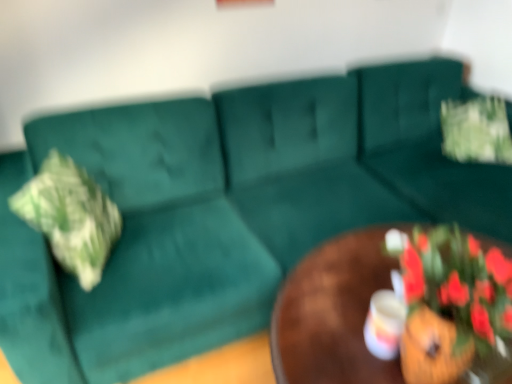
The height and width of the screenshot is (384, 512). I want to click on green fabric flower at upper right, so click(476, 130).

Would you say green textured pillow at left is part of matte white coffee cup at center's contents?

That's incorrect, green textured pillow at left is not inside matte white coffee cup at center.

Can you confirm if matte white coffee cup at center is thinner than green textured pillow at left?

Correct, the width of matte white coffee cup at center is less than that of green textured pillow at left.

Is the position of matte white coffee cup at center more distant than that of green textured pillow at left?

No, it is in front of green textured pillow at left.

Does matte white coffee cup at center have a smaller size compared to green textured pillow at left?

Indeed, matte white coffee cup at center has a smaller size compared to green textured pillow at left.

Can you confirm if matte white coffee cup at center is thinner than brown wooden table at center?

Yes, matte white coffee cup at center is thinner than brown wooden table at center.

Is matte white coffee cup at center oriented away from brown wooden table at center?

No.

Locate an element on the screen. This screenshot has width=512, height=384. coffee cup behind the brown wooden table at center is located at coordinates (384, 324).

Consider the image. Do you think matte white coffee cup at center is within brown wooden table at center, or outside of it?

matte white coffee cup at center is inside brown wooden table at center.

Considering the relative sizes of green textured pillow at left and green fabric flower at upper right in the image provided, is green textured pillow at left shorter than green fabric flower at upper right?

In fact, green textured pillow at left may be taller than green fabric flower at upper right.

The image size is (512, 384). In order to click on pillow below the green fabric flower at upper right (from the image's perspective) in this screenshot , I will do `click(70, 216)`.

Which object is positioned more to the right, green textured pillow at left or green fabric flower at upper right?

Positioned to the right is green fabric flower at upper right.

From the image's perspective, is brown wooden table at center located above green fabric flower at upper right?

Actually, brown wooden table at center appears below green fabric flower at upper right in the image.

From a real-world perspective, is brown wooden table at center located beneath green fabric flower at upper right?

Yes, from a real-world perspective, brown wooden table at center is beneath green fabric flower at upper right.

Considering the sizes of objects brown wooden table at center and green fabric flower at upper right in the image provided, who is smaller, brown wooden table at center or green fabric flower at upper right?

green fabric flower at upper right.

Based on the photo, which is closer, (497, 133) or (72, 231)?

Point (497, 133) is positioned farther from the camera compared to point (72, 231).

Considering the positions of objects green fabric flower at upper right and green textured pillow at left in the image provided, who is more to the right, green fabric flower at upper right or green textured pillow at left?

green fabric flower at upper right is more to the right.

Can you tell me how much green fabric flower at upper right and green textured pillow at left differ in facing direction?

114 degrees separate the facing orientations of green fabric flower at upper right and green textured pillow at left.

Is green fabric flower at upper right further to the viewer compared to green textured pillow at left?

Yes, it is.

Considering the positions of points (379, 309) and (447, 151), is point (379, 309) farther from camera compared to point (447, 151)?

No, (379, 309) is closer to viewer.

Considering the relative sizes of matte white coffee cup at center and green fabric flower at upper right in the image provided, is matte white coffee cup at center taller than green fabric flower at upper right?

No.

Between matte white coffee cup at center and green fabric flower at upper right, which one has smaller size?

With smaller size is matte white coffee cup at center.

Does matte white coffee cup at center turn towards green fabric flower at upper right?

No, matte white coffee cup at center is not oriented towards green fabric flower at upper right.

Can you confirm if green textured pillow at left is positioned to the right of brown wooden table at center?

No, green textured pillow at left is not to the right of brown wooden table at center.

Does point (96, 229) appear closer or farther from the camera than point (353, 375)?

Point (96, 229).

Looking at this image, is green textured pillow at left next to brown wooden table at center and touching it?

No, green textured pillow at left is not beside brown wooden table at center.

In the scene shown: Would you say green textured pillow at left is outside brown wooden table at center?

Indeed, green textured pillow at left is completely outside brown wooden table at center.

Locate an element on the screen. coffee cup on the right of green textured pillow at left is located at coordinates (384, 324).

Locate an element on the screen. The image size is (512, 384). coffee cup located above the brown wooden table at center (from a real-world perspective) is located at coordinates (384, 324).

Based on their spatial positions, is green textured pillow at left or brown wooden table at center further from matte white coffee cup at center?

green textured pillow at left.

In the scene shown: Considering their positions, is green fabric flower at upper right positioned closer to matte white coffee cup at center than green textured pillow at left?

green textured pillow at left is closer to matte white coffee cup at center.

Which object lies nearer to the anchor point brown wooden table at center, matte white coffee cup at center or green textured pillow at left?

matte white coffee cup at center lies closer to brown wooden table at center than the other object.

Which object lies nearer to the anchor point green fabric flower at upper right, brown wooden table at center or matte white coffee cup at center?

The object closer to green fabric flower at upper right is brown wooden table at center.

In the scene shown: Which object lies nearer to the anchor point brown wooden table at center, green textured pillow at left or green fabric flower at upper right?

Based on the image, green textured pillow at left appears to be nearer to brown wooden table at center.

Looking at this image, when comparing their distances from green textured pillow at left, does matte white coffee cup at center or brown wooden table at center seem further?

matte white coffee cup at center is positioned further to the anchor green textured pillow at left.

Considering their positions, is green fabric flower at upper right positioned further to green textured pillow at left than brown wooden table at center?

green fabric flower at upper right is positioned further to the anchor green textured pillow at left.

Considering their positions, is green textured pillow at left positioned closer to matte white coffee cup at center than green fabric flower at upper right?

green textured pillow at left is closer to matte white coffee cup at center.

Find the location of `round table located between green textured pillow at left and green fabric flower at upper right in the left-right direction`. round table located between green textured pillow at left and green fabric flower at upper right in the left-right direction is located at coordinates (331, 314).

You are a GUI agent. You are given a task and a screenshot of the screen. Output one action in this format:
    pyautogui.click(x=<x>, y=<y>)
    Task: Click on the coffee cup between green textured pillow at left and green fabric flower at upper right
    
    Given the screenshot: What is the action you would take?
    pyautogui.click(x=384, y=324)

The image size is (512, 384). I want to click on coffee cup situated between green textured pillow at left and brown wooden table at center from left to right, so click(384, 324).

Where is `coffee cup positioned between brown wooden table at center and green fabric flower at upper right from near to far`? The width and height of the screenshot is (512, 384). coffee cup positioned between brown wooden table at center and green fabric flower at upper right from near to far is located at coordinates tap(384, 324).